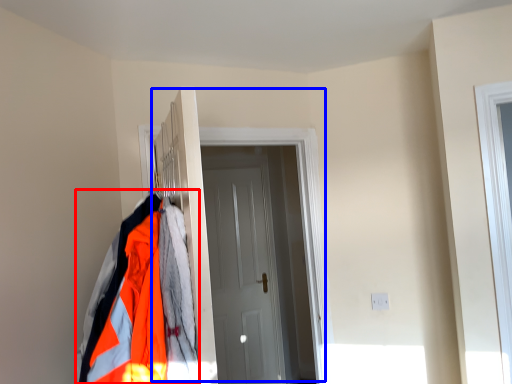
Question: Which object appears closest to the camera in this image, jacket (highlighted by a red box) or door (highlighted by a blue box)?

Choices:
 (A) jacket
 (B) door

Answer: (A)